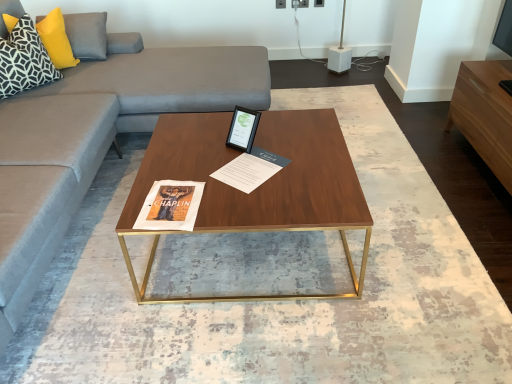
At what (x,y) coordinates should I click in order to perform the action: click on empty space that is in between matte black tablet at center and matte paper magazine at center. Please return your answer as a coordinate pair (x, y). Looking at the image, I should click on (228, 153).